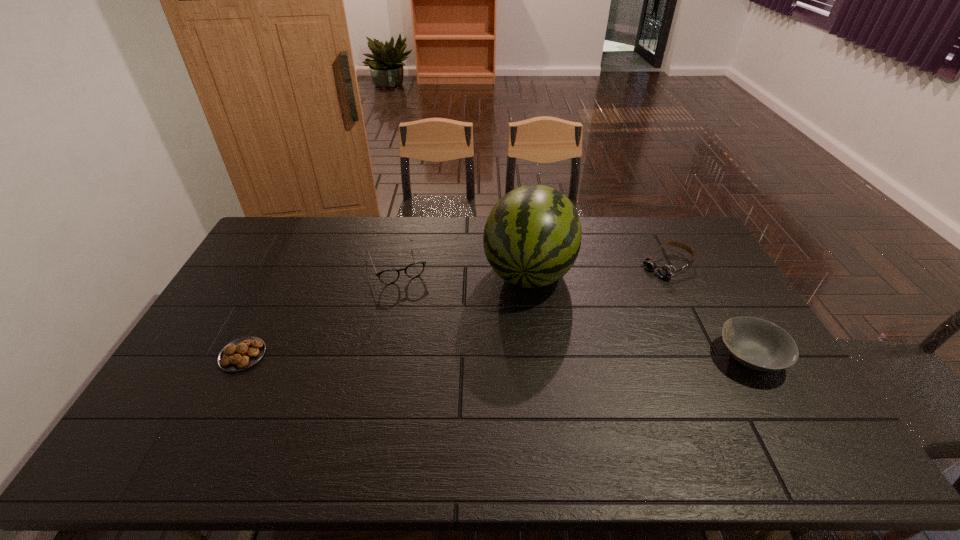
You are a GUI agent. You are given a task and a screenshot of the screen. Output one action in this format:
    pyautogui.click(x=<x>, y=<y>)
    Task: Click on the spectacles at the far edge
    
    Given the screenshot: What is the action you would take?
    pyautogui.click(x=389, y=276)

Locate an element on the screen. The height and width of the screenshot is (540, 960). object positioned at the left edge is located at coordinates (242, 353).

The height and width of the screenshot is (540, 960). Find the location of `bowl present at the right edge`. bowl present at the right edge is located at coordinates (758, 344).

Identify the location of goggles that is at the right edge. The image size is (960, 540). tap(665, 271).

You are a GUI agent. You are given a task and a screenshot of the screen. Output one action in this format:
    pyautogui.click(x=<x>, y=<y>)
    Task: Click on the object that is positioned at the far right corner
    Image resolution: width=960 pixels, height=540 pixels.
    Given the screenshot: What is the action you would take?
    pyautogui.click(x=665, y=271)

This screenshot has height=540, width=960. I want to click on vacant region at the far edge of the desktop, so click(316, 224).

Find the location of a particular element. free space at the near edge of the desktop is located at coordinates (508, 392).

Find the location of a particular element. free space at the left edge of the desktop is located at coordinates [x=295, y=256].

The width and height of the screenshot is (960, 540). In order to click on vacant region at the right edge of the desktop in this screenshot , I will do `click(709, 291)`.

The height and width of the screenshot is (540, 960). I want to click on blank space at the far left corner of the desktop, so click(x=290, y=221).